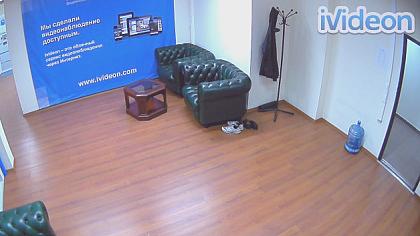
At what (x,y) coordinates should I click in order to perform the action: click on wood floor. Please return your answer as a coordinate pair (x, y). The width and height of the screenshot is (420, 236). Looking at the image, I should click on (208, 197).